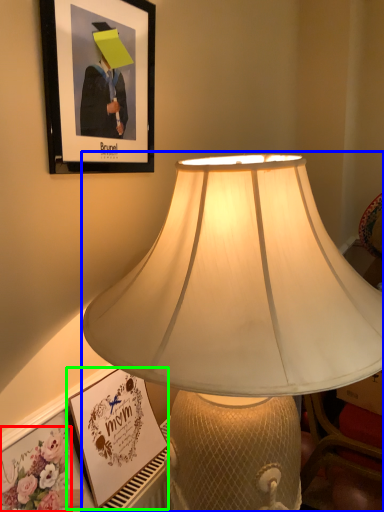
Question: Based on their relative distances, which object is nearer to flower (highlighted by a red box)? Choose from lamp (highlighted by a blue box) and picture frame (highlighted by a green box).

Choices:
 (A) lamp
 (B) picture frame

Answer: (B)